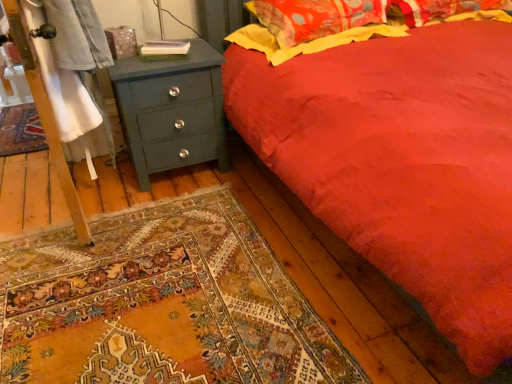
Question: Considering the relative positions of teal painted wood chest of drawers at left and fluffy cotton pillow at upper right in the image provided, is teal painted wood chest of drawers at left in front of fluffy cotton pillow at upper right?

Choices:
 (A) yes
 (B) no

Answer: (A)

Question: Is teal painted wood chest of drawers at left not within fluffy cotton pillow at upper right?

Choices:
 (A) no
 (B) yes

Answer: (B)

Question: From a real-world perspective, is teal painted wood chest of drawers at left located beneath fluffy cotton pillow at upper right?

Choices:
 (A) yes
 (B) no

Answer: (A)

Question: Does teal painted wood chest of drawers at left have a smaller size compared to fluffy cotton pillow at upper right?

Choices:
 (A) yes
 (B) no

Answer: (B)

Question: Is teal painted wood chest of drawers at left bigger than fluffy cotton pillow at upper right?

Choices:
 (A) no
 (B) yes

Answer: (B)

Question: Is teal painted wood chest of drawers at left taller than fluffy cotton pillow at upper right?

Choices:
 (A) yes
 (B) no

Answer: (A)

Question: From a real-world perspective, is fluffy cotton pillow at upper right over teal painted wood chest of drawers at left?

Choices:
 (A) yes
 (B) no

Answer: (A)

Question: Is fluffy cotton pillow at upper right oriented towards teal painted wood chest of drawers at left?

Choices:
 (A) no
 (B) yes

Answer: (A)

Question: From a real-world perspective, is fluffy cotton pillow at upper right physically below teal painted wood chest of drawers at left?

Choices:
 (A) no
 (B) yes

Answer: (A)

Question: Can you confirm if fluffy cotton pillow at upper right is bigger than teal painted wood chest of drawers at left?

Choices:
 (A) yes
 (B) no

Answer: (B)

Question: Can you confirm if fluffy cotton pillow at upper right is smaller than teal painted wood chest of drawers at left?

Choices:
 (A) yes
 (B) no

Answer: (A)

Question: Does fluffy cotton pillow at upper right have a greater width compared to teal painted wood chest of drawers at left?

Choices:
 (A) no
 (B) yes

Answer: (B)

Question: From the image's perspective, is fluffy cotton pillow at upper right located above or below teal painted wood chest of drawers at left?

Choices:
 (A) below
 (B) above

Answer: (B)